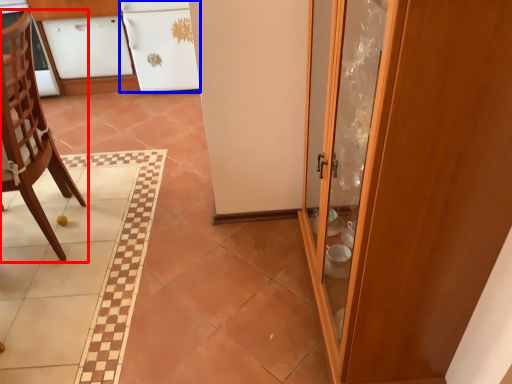
Question: Which object is further to the camera taking this photo, chair (highlighted by a red box) or cabinetry (highlighted by a blue box)?

Choices:
 (A) chair
 (B) cabinetry

Answer: (B)